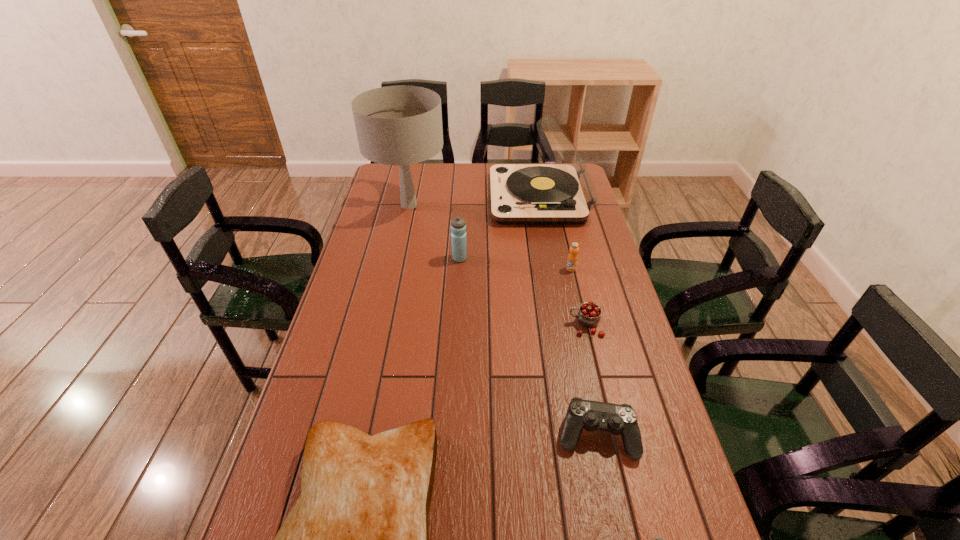
Image resolution: width=960 pixels, height=540 pixels. What are the coordinates of `vacant space that satisfies the following two spatial constraints: 1. on the handle side of the fourth nearest object; 2. on the front-facing side of the tallest object` in the screenshot? It's located at (557, 205).